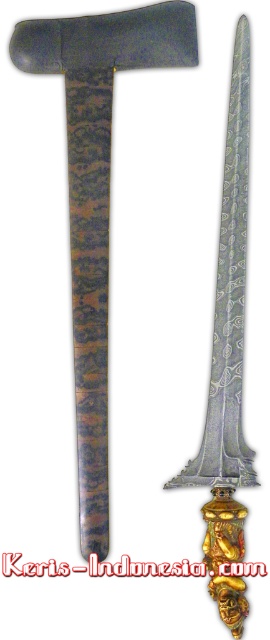
Question: Is polished silver sword at center to the left of silver polished metal sword at center from the viewer's perspective?

Choices:
 (A) yes
 (B) no

Answer: (A)

Question: Which object appears farthest from the camera in this image?

Choices:
 (A) polished silver sword at center
 (B) silver polished metal sword at center

Answer: (A)

Question: Among these objects, which one is nearest to the camera?

Choices:
 (A) silver polished metal sword at center
 (B) polished silver sword at center

Answer: (A)

Question: Does polished silver sword at center have a larger size compared to silver polished metal sword at center?

Choices:
 (A) no
 (B) yes

Answer: (B)

Question: Can you confirm if polished silver sword at center is bigger than silver polished metal sword at center?

Choices:
 (A) yes
 (B) no

Answer: (A)